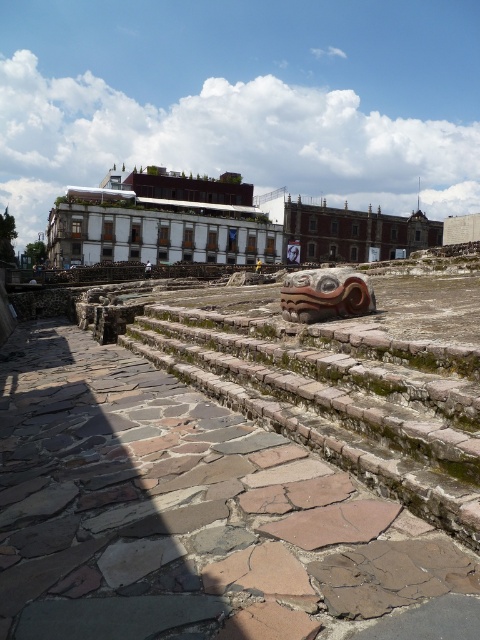
You are an archaeologist standing on the rustic stone stairs at center. You want to reach the white stone amphitheater at center. Which direction should you move to get there?

The white stone amphitheater at center is above the rustic stone stairs at center, so you should move upward to reach it.

You are a tour guide leading a group through the archaeological site. You want to point out the rustic stone stairs at center to your group. Where should you direct your audience to look?

The rustic stone stairs at center are located at point (340, 400).